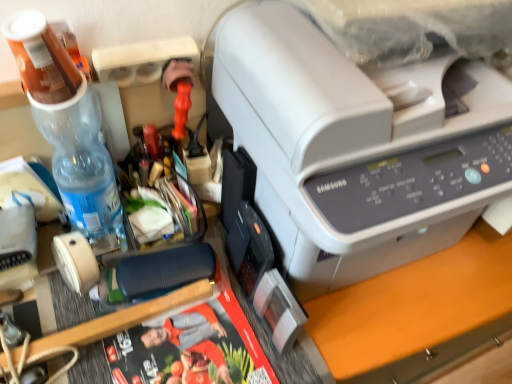
Question: From the image's perspective, is clear plastic bottle at left located above or below beige matte tape at lower left?

Choices:
 (A) above
 (B) below

Answer: (A)

Question: Relative to beige matte tape at lower left, is clear plastic bottle at left in front or behind?

Choices:
 (A) front
 (B) behind

Answer: (A)

Question: Which object is the farthest from the translucent plastic bottle at upper left?

Choices:
 (A) matte black magazine at center
 (B) clear plastic bottle at left
 (C) beige matte tape at lower left
 (D) white plastic printer at upper right

Answer: (A)

Question: Based on their relative distances, which object is farther from the white plastic printer at upper right?

Choices:
 (A) translucent plastic bottle at upper left
 (B) matte black magazine at center
 (C) beige matte tape at lower left
 (D) clear plastic bottle at left

Answer: (C)